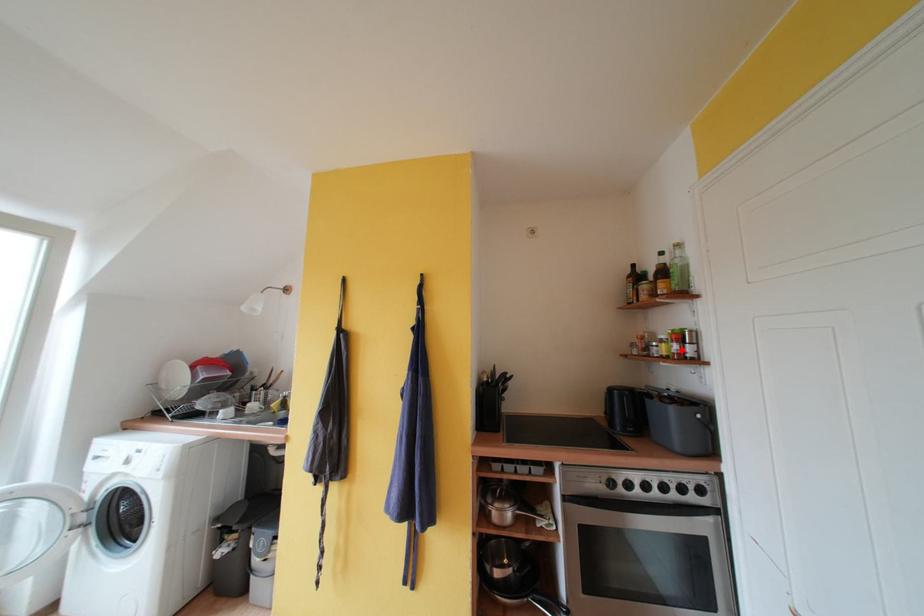
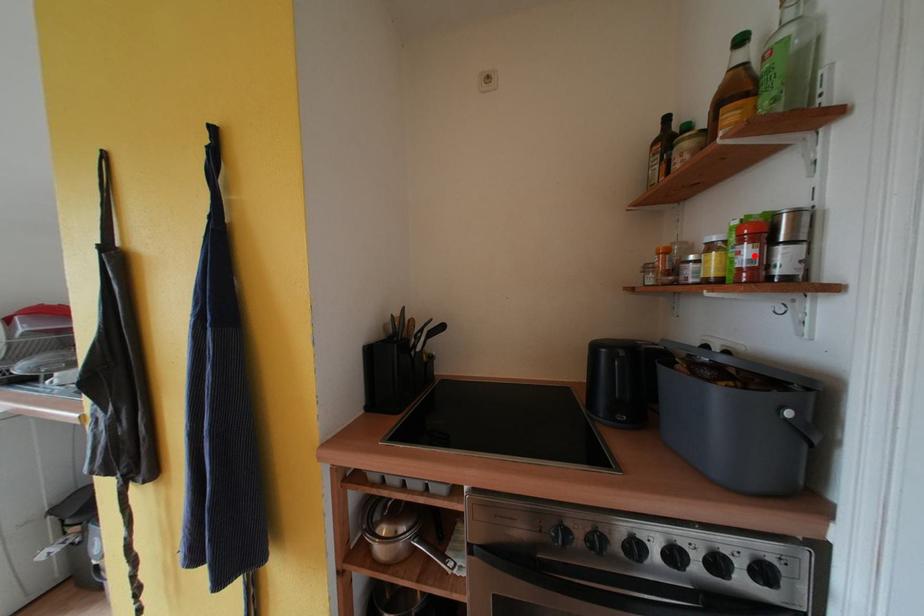
I am providing you with two images of the same scene from different viewpoints. A red point is marked on the first image and another point is marked on the second image. Do the highlighted points in image1 and image2 indicate the same real-world spot?

Yes